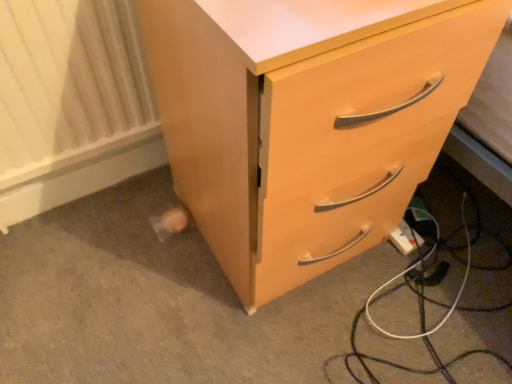
Question: Is matte wood chest of drawers at lower right taller or shorter than white plastic extension cord at lower right?

Choices:
 (A) tall
 (B) short

Answer: (A)

Question: Is point (355, 236) closer or farther from the camera than point (410, 249)?

Choices:
 (A) closer
 (B) farther

Answer: (A)

Question: Which of these objects is positioned closest to the matte wood chest of drawers at lower right?

Choices:
 (A) white textured radiator at lower left
 (B) white plastic extension cord at lower right

Answer: (A)

Question: Based on their relative distances, which object is farther from the white plastic extension cord at lower right?

Choices:
 (A) matte wood chest of drawers at lower right
 (B) white textured radiator at lower left

Answer: (B)